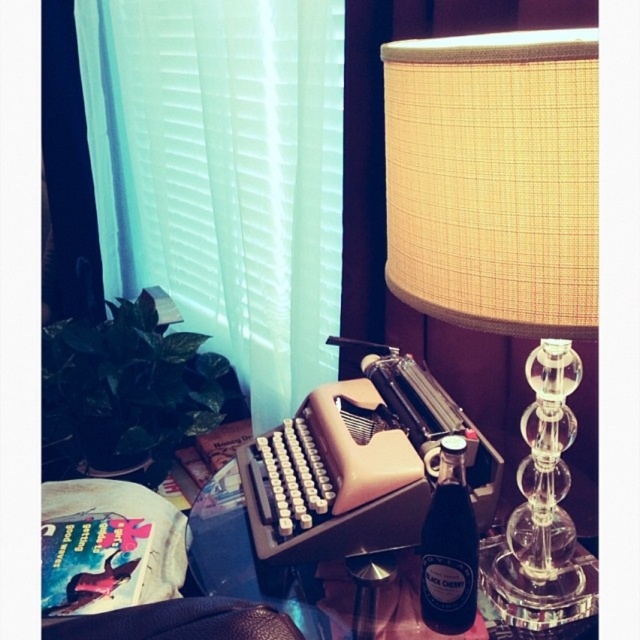
Does black glass bottle at right appear over leather at lower left?

Indeed, black glass bottle at right is positioned over leather at lower left.

Does black glass bottle at right appear under leather at lower left?

No.

Is point (433, 579) positioned after point (236, 621)?

Yes, it is behind point (236, 621).

Locate an element on the screen. black glass bottle at right is located at coordinates (449, 547).

Who is higher up, beige fabric lampshade at upper right or leather at lower left?

beige fabric lampshade at upper right is above.

This screenshot has width=640, height=640. What do you see at coordinates (506, 256) in the screenshot?
I see `beige fabric lampshade at upper right` at bounding box center [506, 256].

At what (x,y) coordinates should I click in order to perform the action: click on beige fabric lampshade at upper right. Please return your answer as a coordinate pair (x, y). The image size is (640, 640). Looking at the image, I should click on (506, 256).

What do you see at coordinates (257, 563) in the screenshot?
I see `translucent glass table at center` at bounding box center [257, 563].

Which is in front, point (388, 628) or point (273, 627)?

Point (273, 627) is more forward.

Measure the distance between translucent glass table at center and camera.

28.13 inches

Locate an element on the screen. translucent glass table at center is located at coordinates (257, 563).